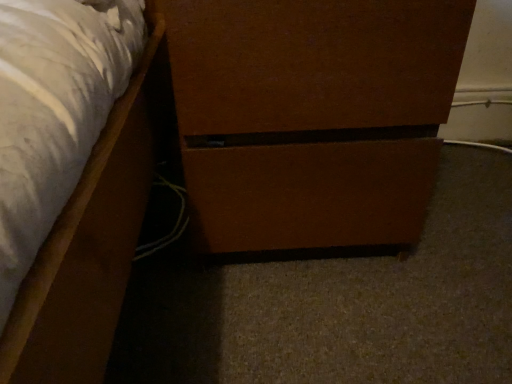
Locate an element on the screen. Image resolution: width=512 pixels, height=384 pixels. vacant region in front of matte brown chest of drawers at center is located at coordinates (307, 317).